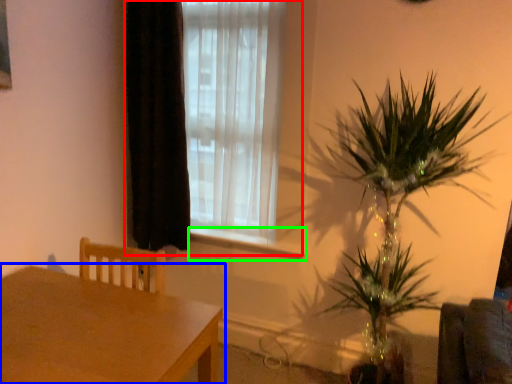
Question: Which object is positioned closest to window (highlighted by a red box)? Select from table (highlighted by a blue box) and window sill (highlighted by a green box).

Choices:
 (A) table
 (B) window sill

Answer: (B)